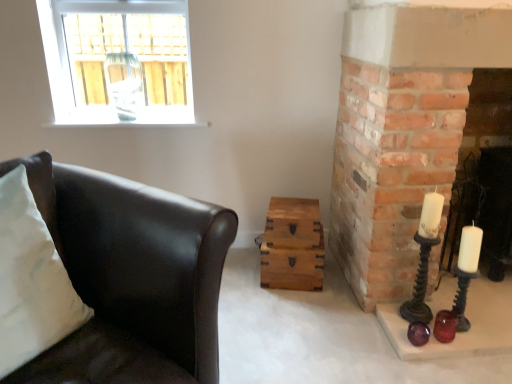
Question: Considering the relative sizes of translucent amber glass candle holder at lower right, which appears as the second candle holder when viewed from the top, and matte black leather couch at left in the image provided, is translucent amber glass candle holder at lower right, which appears as the second candle holder when viewed from the top, smaller than matte black leather couch at left?

Choices:
 (A) no
 (B) yes

Answer: (B)

Question: From the image's perspective, is translucent amber glass candle holder at lower right, marked as the 1th candle holder in a bottom-to-top arrangement, over matte black leather couch at left?

Choices:
 (A) no
 (B) yes

Answer: (A)

Question: From a real-world perspective, does translucent amber glass candle holder at lower right, marked as the 1th candle holder in a bottom-to-top arrangement, stand above matte black leather couch at left?

Choices:
 (A) yes
 (B) no

Answer: (B)

Question: Is matte black leather couch at left surrounded by translucent amber glass candle holder at lower right, which appears as the second candle holder when viewed from the top?

Choices:
 (A) yes
 (B) no

Answer: (B)

Question: Can you confirm if translucent amber glass candle holder at lower right, which appears as the second candle holder when viewed from the top, is taller than matte black leather couch at left?

Choices:
 (A) yes
 (B) no

Answer: (B)

Question: Is smooth brick fireplace at right with translucent amber glass candle holder at lower right, marked as the 1th candle holder in a bottom-to-top arrangement?

Choices:
 (A) no
 (B) yes

Answer: (A)

Question: From a real-world perspective, is smooth brick fireplace at right physically below translucent amber glass candle holder at lower right, marked as the 1th candle holder in a bottom-to-top arrangement?

Choices:
 (A) no
 (B) yes

Answer: (A)

Question: Is smooth brick fireplace at right wider than translucent amber glass candle holder at lower right, which appears as the second candle holder when viewed from the top?

Choices:
 (A) no
 (B) yes

Answer: (B)

Question: Considering the relative sizes of smooth brick fireplace at right and translucent amber glass candle holder at lower right, marked as the 1th candle holder in a bottom-to-top arrangement, in the image provided, is smooth brick fireplace at right shorter than translucent amber glass candle holder at lower right, marked as the 1th candle holder in a bottom-to-top arrangement,?

Choices:
 (A) yes
 (B) no

Answer: (B)

Question: Is smooth brick fireplace at right behind translucent amber glass candle holder at lower right, which appears as the second candle holder when viewed from the top?

Choices:
 (A) no
 (B) yes

Answer: (A)

Question: Is translucent amber glass candle holder at lower right, which appears as the second candle holder when viewed from the top, inside smooth brick fireplace at right?

Choices:
 (A) no
 (B) yes

Answer: (A)

Question: Is smooth brick fireplace at right further to camera compared to matte black candle holder at right, which is the 2th candle holder from bottom to top?

Choices:
 (A) yes
 (B) no

Answer: (A)